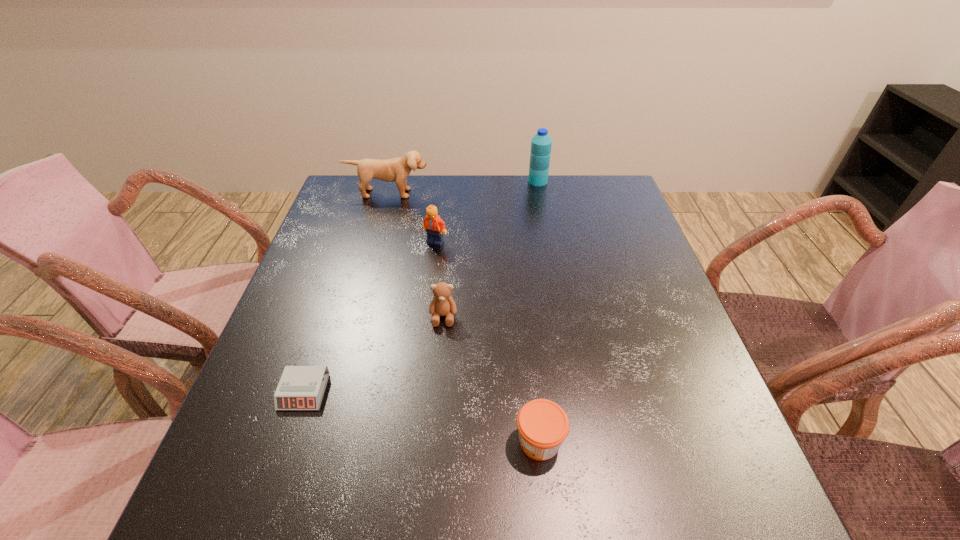
Where is `the farthest object`? This screenshot has height=540, width=960. the farthest object is located at coordinates (541, 143).

The height and width of the screenshot is (540, 960). I want to click on the tallest object, so pyautogui.click(x=541, y=143).

The image size is (960, 540). In order to click on the second farthest object in this screenshot , I will do `click(397, 170)`.

Identify the location of puppy. (397, 170).

Locate an element on the screen. the third tallest object is located at coordinates (434, 226).

The width and height of the screenshot is (960, 540). Find the location of `the third farthest object`. the third farthest object is located at coordinates tap(434, 226).

The height and width of the screenshot is (540, 960). In order to click on the third shortest object in this screenshot , I will do `click(442, 304)`.

Where is `teddy bear`? Image resolution: width=960 pixels, height=540 pixels. teddy bear is located at coordinates (x=442, y=304).

This screenshot has height=540, width=960. Find the location of `the nearest object`. the nearest object is located at coordinates (542, 424).

The image size is (960, 540). Find the location of `the fifth tallest object`. the fifth tallest object is located at coordinates (542, 424).